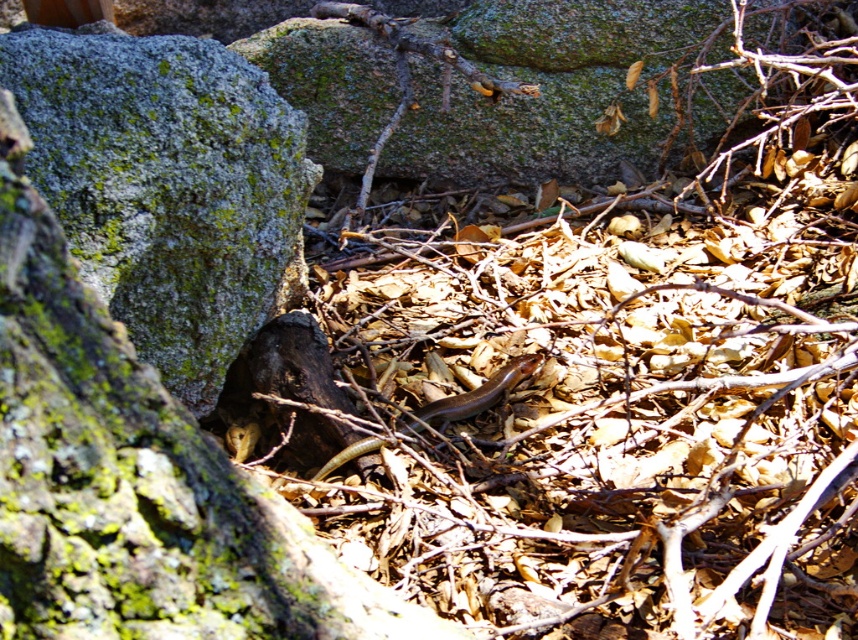
Question: Which point is farther to the camera?

Choices:
 (A) green mossy rock at center-left
 (B) brown matte snake at center

Answer: (B)

Question: Does green mossy rock at center-left have a lesser width compared to brown matte snake at center?

Choices:
 (A) no
 (B) yes

Answer: (A)

Question: Which point is closer to the camera?

Choices:
 (A) (77, 33)
 (B) (412, 426)

Answer: (B)

Question: Where is green mossy rock at center-left located in relation to brown matte snake at center in the image?

Choices:
 (A) left
 (B) right

Answer: (A)

Question: Which point is closer to the camera taking this photo?

Choices:
 (A) coord(478,401)
 (B) coord(236,186)

Answer: (B)

Question: Does green mossy rock at center-left appear on the left side of brown matte snake at center?

Choices:
 (A) yes
 (B) no

Answer: (A)